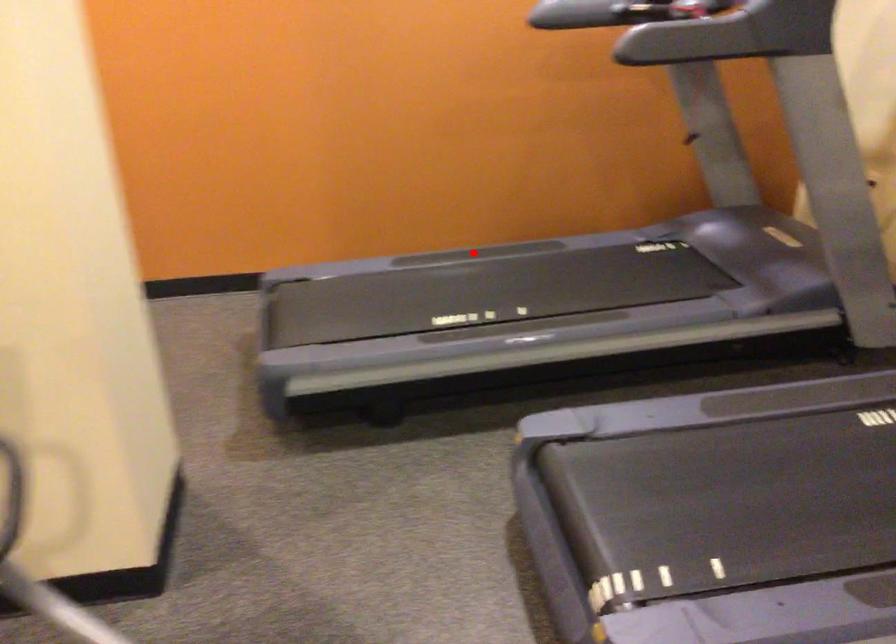
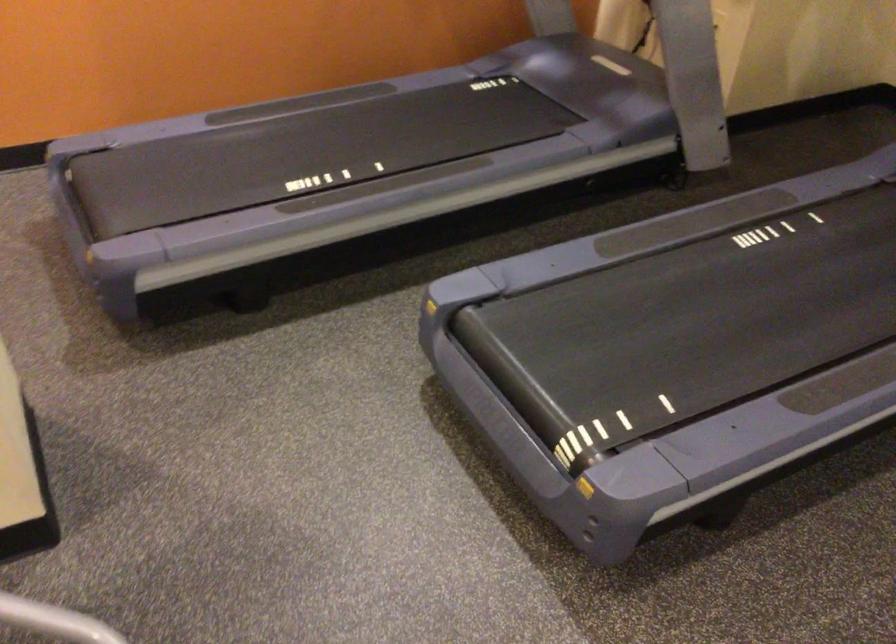
Find the pixel in the second image that matches the highlighted location in the first image.

(294, 104)